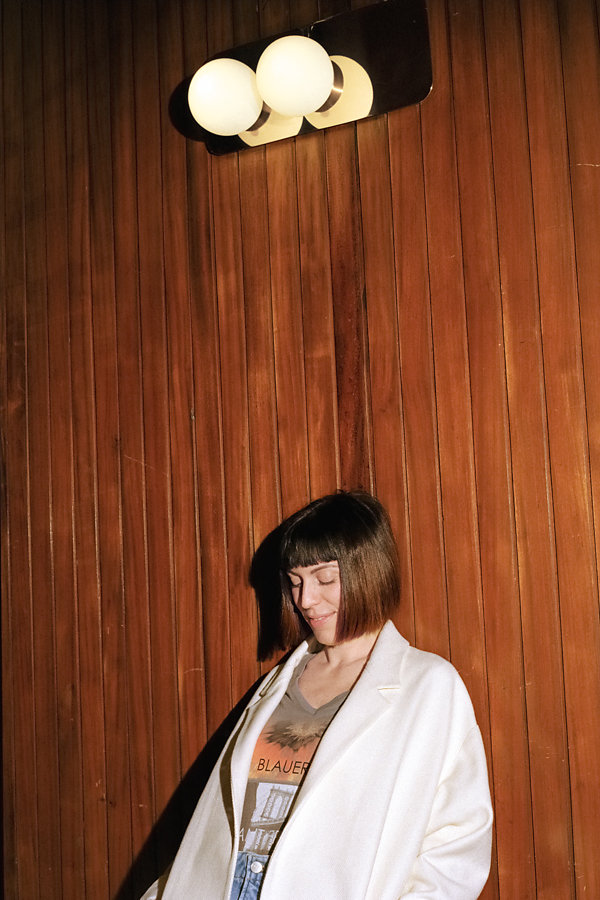
This screenshot has width=600, height=900. Find the location of `left light reflection`. left light reflection is located at coordinates (273, 118).